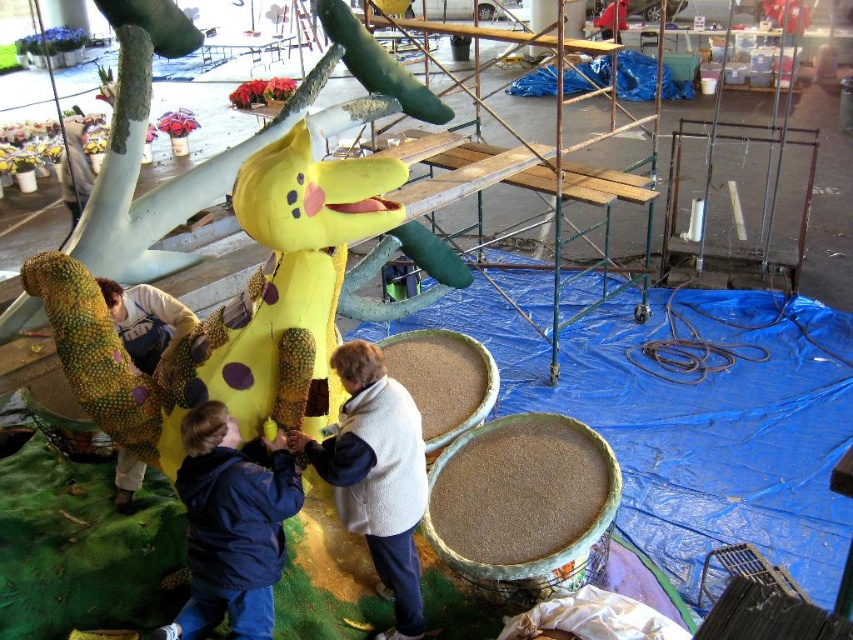
Can you confirm if white fleece jacket at center is positioned below matte yellow costume at center?

Yes.

Measure the distance between white fleece jacket at center and matte yellow costume at center.

white fleece jacket at center and matte yellow costume at center are 4.72 feet apart.

I want to click on white fleece jacket at center, so click(376, 476).

Which of these two, blue fleece jacket at lower left or white fleece jacket at center, stands shorter?

With less height is blue fleece jacket at lower left.

Is blue fleece jacket at lower left behind white fleece jacket at center?

No.

Who is more forward, (271, 444) or (373, 452)?

Point (373, 452)

Locate an element on the screen. blue fleece jacket at lower left is located at coordinates (231, 524).

Is blue fleece jacket at lower left further to the viewer compared to matte yellow costume at center?

No, it is not.

In the scene shown: Who is more distant from viewer, (245, 544) or (115, 465)?

The point (115, 465) is behind.

Where is `blue fleece jacket at lower left`? This screenshot has width=853, height=640. blue fleece jacket at lower left is located at coordinates (231, 524).

Identify the location of blue fleece jacket at lower left. Image resolution: width=853 pixels, height=640 pixels. (231, 524).